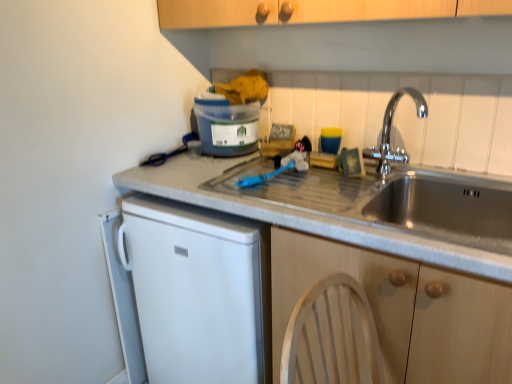
Question: In the image, is wooden cabinet at lower right on the left side or the right side of matte plastic container at upper center?

Choices:
 (A) left
 (B) right

Answer: (B)

Question: In the image, is wooden cabinet at lower right positioned in front of or behind matte plastic container at upper center?

Choices:
 (A) behind
 (B) front

Answer: (B)

Question: Which is nearer to the chrome metallic faucet at upper right?

Choices:
 (A) matte plastic container at upper center
 (B) wooden cabinet at lower right

Answer: (A)

Question: Which of these objects is positioned farthest from the matte plastic container at upper center?

Choices:
 (A) wooden cabinet at lower right
 (B) chrome metallic faucet at upper right

Answer: (A)